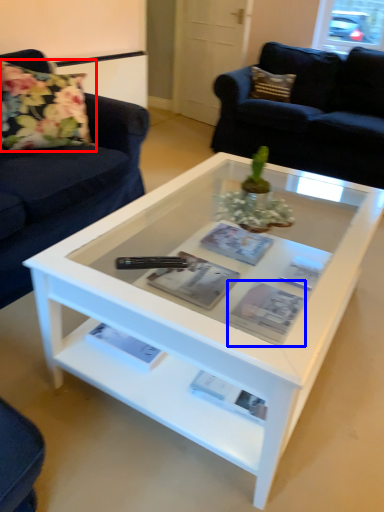
Question: Which point is further to the camera, flower (highlighted by a red box) or magazine (highlighted by a blue box)?

Choices:
 (A) flower
 (B) magazine

Answer: (A)